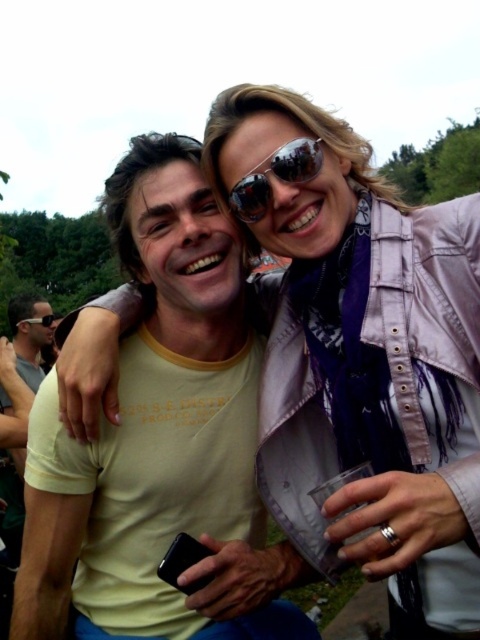
You are a photographer trying to capture a clear shot of both the matte black sunglasses at upper left and the black reflective sunglasses at upper center. Which sunglasses should you focus on first to ensure they are in sharp focus?

You should focus on the matte black sunglasses at upper left first because it is closer to the viewer than the black reflective sunglasses at upper center, so focusing on the closer object ensures sharpness before adjusting for the farther one.